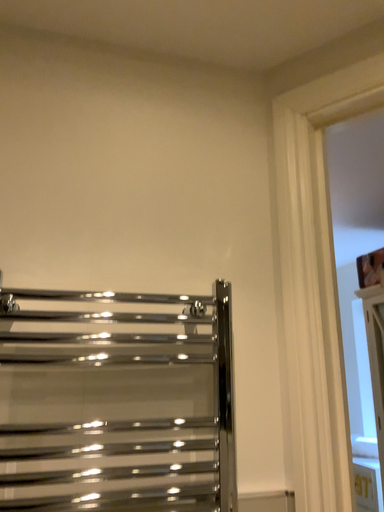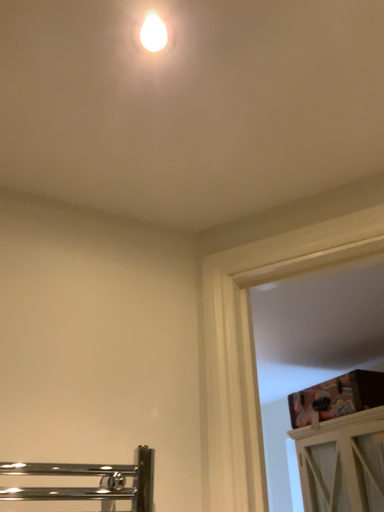
Question: How did the camera likely rotate when shooting the video?

Choices:
 (A) rotated left
 (B) rotated right

Answer: (B)